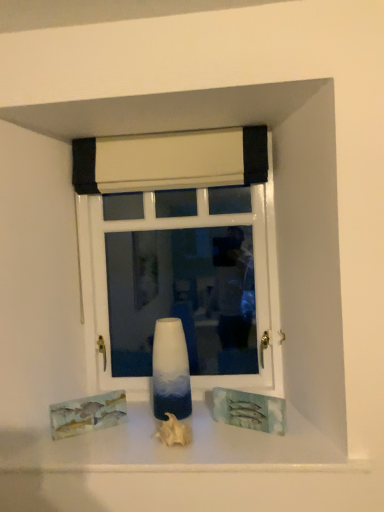
Question: In which direction should I rotate to look at white matte seashell at center, placed as the second art when sorted from left to right?

Choices:
 (A) right
 (B) left

Answer: (B)

Question: Should I look upward or downward to see watercolor paper painting at lower left, arranged as the first art when viewed from the left?

Choices:
 (A) down
 (B) up

Answer: (A)

Question: Does white matte seashell at center, the first art viewed from the right, touch white glossy vase at center?

Choices:
 (A) yes
 (B) no

Answer: (B)

Question: Is white matte seashell at center, the first art viewed from the right, positioned in front of white glossy vase at center?

Choices:
 (A) yes
 (B) no

Answer: (A)

Question: From a real-world perspective, is white matte seashell at center, placed as the second art when sorted from left to right, below white glossy vase at center?

Choices:
 (A) yes
 (B) no

Answer: (A)

Question: Is the position of white matte seashell at center, placed as the second art when sorted from left to right, more distant than that of white glossy vase at center?

Choices:
 (A) yes
 (B) no

Answer: (B)

Question: Can you confirm if white matte seashell at center, the first art viewed from the right, is smaller than white glossy vase at center?

Choices:
 (A) no
 (B) yes

Answer: (B)

Question: Considering the relative sizes of white matte seashell at center, placed as the second art when sorted from left to right, and white glossy vase at center in the image provided, is white matte seashell at center, placed as the second art when sorted from left to right, wider than white glossy vase at center?

Choices:
 (A) yes
 (B) no

Answer: (A)

Question: From a real-world perspective, is white glossy window at center below watercolor paper painting at lower left, arranged as the first art when viewed from the left?

Choices:
 (A) yes
 (B) no

Answer: (B)

Question: Does white glossy window at center have a greater height compared to watercolor paper painting at lower left, arranged as the first art when viewed from the left?

Choices:
 (A) yes
 (B) no

Answer: (A)

Question: Does white glossy window at center come in front of watercolor paper painting at lower left, marked as the 2th art in a right-to-left arrangement?

Choices:
 (A) no
 (B) yes

Answer: (A)

Question: Can you confirm if white glossy window at center is wider than watercolor paper painting at lower left, marked as the 2th art in a right-to-left arrangement?

Choices:
 (A) yes
 (B) no

Answer: (A)

Question: Can you confirm if white glossy window at center is bigger than watercolor paper painting at lower left, arranged as the first art when viewed from the left?

Choices:
 (A) yes
 (B) no

Answer: (A)

Question: Is watercolor paper painting at lower left, marked as the 2th art in a right-to-left arrangement, a part of white glossy window at center?

Choices:
 (A) no
 (B) yes

Answer: (A)

Question: Can you confirm if white glossy window at center is wider than white fabric curtain at upper center?

Choices:
 (A) no
 (B) yes

Answer: (A)